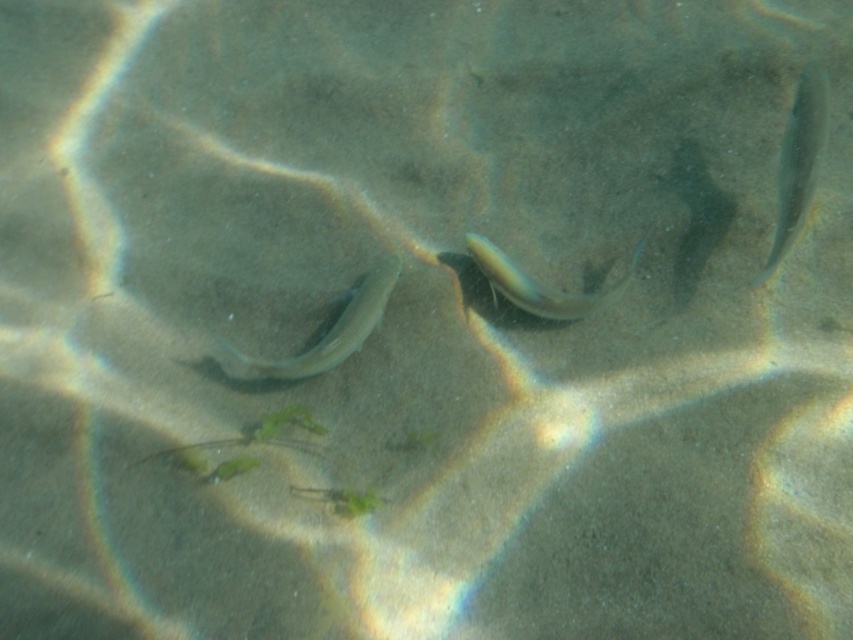
Question: Can you confirm if translucent greenish fish at center is thinner than translucent rubber fish at center?

Choices:
 (A) yes
 (B) no

Answer: (B)

Question: Which point appears farthest from the camera in this image?

Choices:
 (A) (325, 369)
 (B) (804, 202)
 (C) (608, 289)

Answer: (C)

Question: Which of these objects is positioned closest to the shiny silver fish at upper right?

Choices:
 (A) translucent greenish fish at center
 (B) translucent rubber fish at center

Answer: (B)

Question: Can you confirm if shiny silver fish at upper right is positioned to the left of translucent greenish fish at center?

Choices:
 (A) yes
 (B) no

Answer: (B)

Question: Which of these objects is positioned closest to the translucent rubber fish at center?

Choices:
 (A) shiny silver fish at upper right
 (B) translucent greenish fish at center

Answer: (B)

Question: Is shiny silver fish at upper right to the left of translucent greenish fish at center from the viewer's perspective?

Choices:
 (A) no
 (B) yes

Answer: (A)